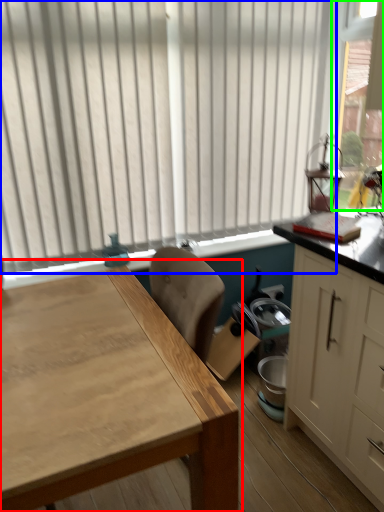
Question: Which object is positioned closest to table (highlighted by a red box)? Select from window (highlighted by a blue box) and window screen (highlighted by a green box).

Choices:
 (A) window
 (B) window screen

Answer: (A)